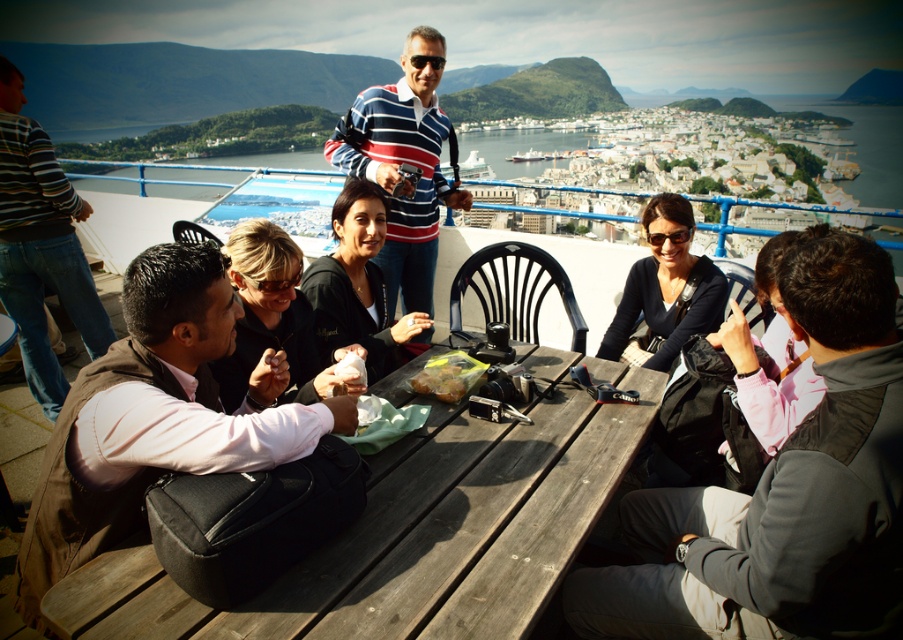
You are standing at the picnic table and want to place a small item between the brown fabric vest at lower left and the striped sweater at left. Based on their positions, where should you place it?

The brown fabric vest at lower left is positioned under the striped sweater at left, so placing the item between them would require placing it above the brown fabric vest at lower left and below the striped sweater at left.

You are standing at the picnic table and want to hand a drink to both the person wearing the striped sweater at left and the person wearing the striped cotton shirt at center. Which person should you approach first if you want to give the drink to the one closer to you?

The striped sweater at left is to the left of striped cotton shirt at center, so you should approach the person wearing the striped sweater at left first as they are closer to you.

You are standing at the picnic table and want to take a photo of both the point at coordinates point (364,232) and the point at coordinates point (467,369). Which point is closer to you so that you can focus on it first?

Point (364,232) is closer to you than point (467,369), so you can focus on it first.